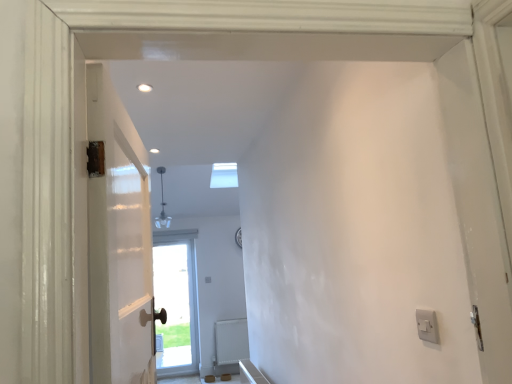
Question: Is point (194, 329) positioned closer to the camera than point (420, 327)?

Choices:
 (A) closer
 (B) farther

Answer: (B)

Question: From the image's perspective, is matte brown door at center, placed as the 1th door when sorted from back to front, positioned above or below white plastic switch at right?

Choices:
 (A) below
 (B) above

Answer: (A)

Question: Estimate the real-world distances between objects in this image. Which object is farther from the white matte radiator at lower center?

Choices:
 (A) white plastic switch at right
 (B) matte brown door at center, the 2th door viewed from the top
 (C) white painted wood door at left, the second door from the left

Answer: (A)

Question: Which of these objects is positioned closest to the white matte radiator at lower center?

Choices:
 (A) white plastic switch at right
 (B) white painted wood door at left, the second door positioned from the back
 (C) matte brown door at center, arranged as the first door when viewed from the left

Answer: (C)